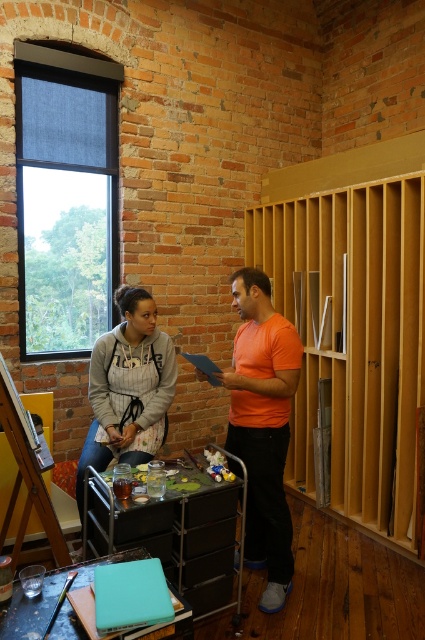
Does wooden at right come behind orange matte shirt at center?

Yes.

Based on the photo, is wooden at right to the right of orange matte shirt at center from the viewer's perspective?

Indeed, wooden at right is positioned on the right side of orange matte shirt at center.

Who is more distant from viewer, (365,465) or (248,536)?

The point (365,465) is behind.

Where is `wooden at right`? The image size is (425, 640). wooden at right is located at coordinates (353, 336).

Does metallic silver cart at center have a larger size compared to wooden easel at lower left?

Yes, metallic silver cart at center is bigger than wooden easel at lower left.

Consider the image. Does metallic silver cart at center have a greater width compared to wooden easel at lower left?

Indeed, metallic silver cart at center has a greater width compared to wooden easel at lower left.

Where is `metallic silver cart at center`? The height and width of the screenshot is (640, 425). metallic silver cart at center is located at coordinates (190, 538).

The width and height of the screenshot is (425, 640). I want to click on metallic silver cart at center, so click(190, 538).

Who is positioned more to the left, orange matte shirt at center or metallic silver cart at center?

metallic silver cart at center

Can you confirm if orange matte shirt at center is positioned to the right of metallic silver cart at center?

Indeed, orange matte shirt at center is positioned on the right side of metallic silver cart at center.

Between point (283, 449) and point (167, 516), which one is positioned in front?

Positioned in front is point (167, 516).

You are a GUI agent. You are given a task and a screenshot of the screen. Output one action in this format:
    pyautogui.click(x=<x>, y=<y>)
    Task: Click on the orange matte shirt at center
    This screenshot has height=640, width=425.
    Given the screenshot: What is the action you would take?
    pyautogui.click(x=263, y=426)